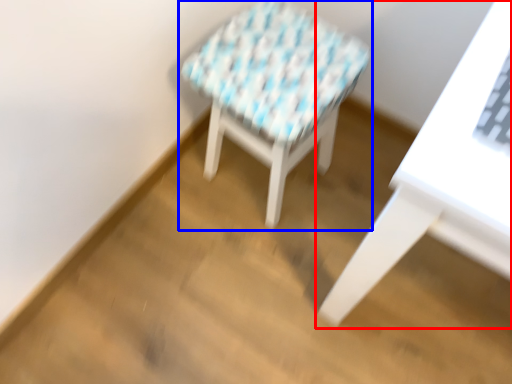
Question: Which object is closer to the camera taking this photo, table (highlighted by a red box) or stool (highlighted by a blue box)?

Choices:
 (A) table
 (B) stool

Answer: (A)